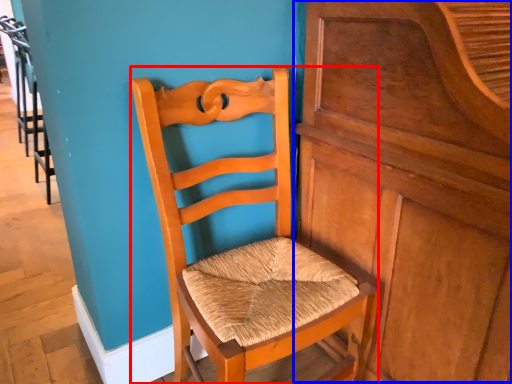
Question: Which object appears farthest to the camera in this image, chair (highlighted by a red box) or dresser (highlighted by a blue box)?

Choices:
 (A) chair
 (B) dresser

Answer: (A)